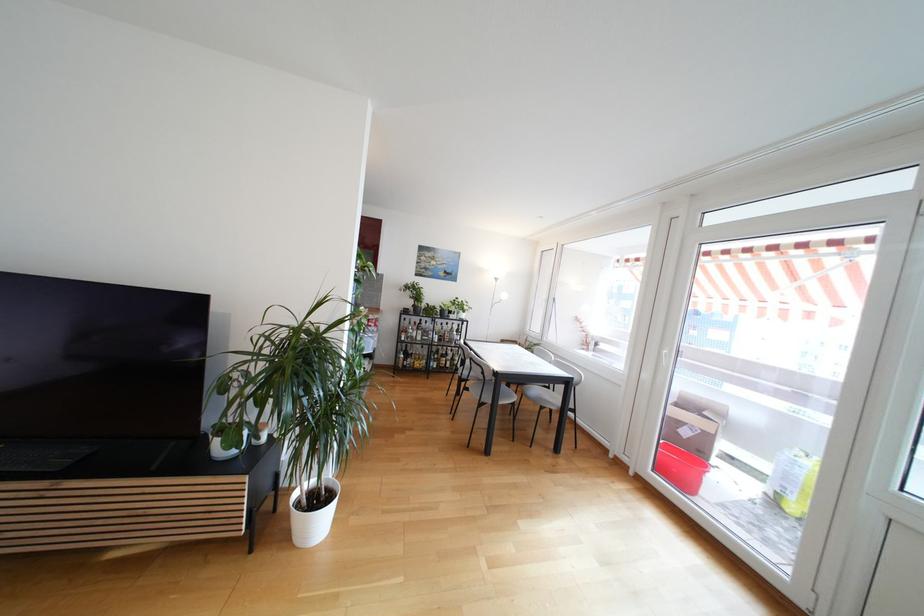
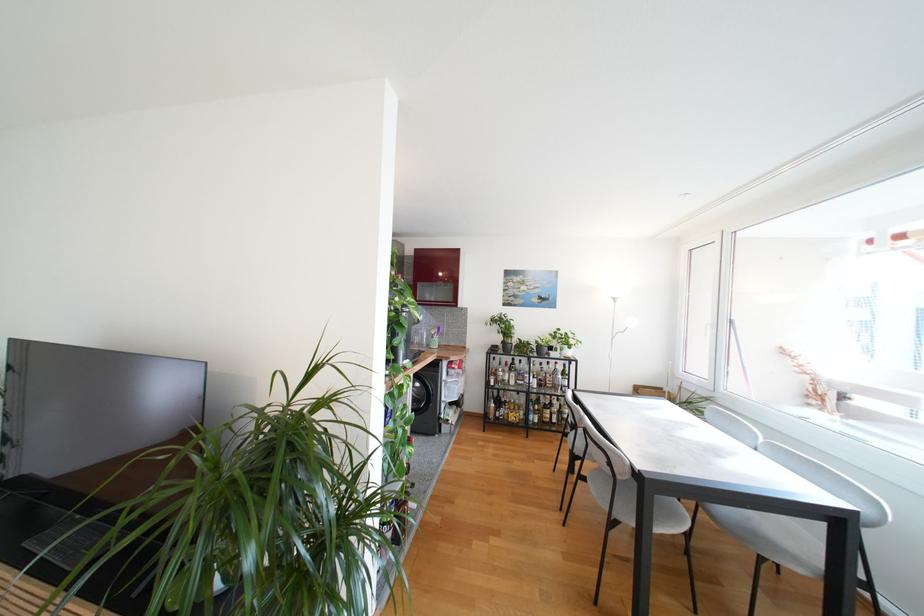
Question: The images are taken continuously from a first-person perspective. In which direction is your viewpoint rotating?

Choices:
 (A) Left
 (B) Right
 (C) Up
 (D) Down

Answer: (A)